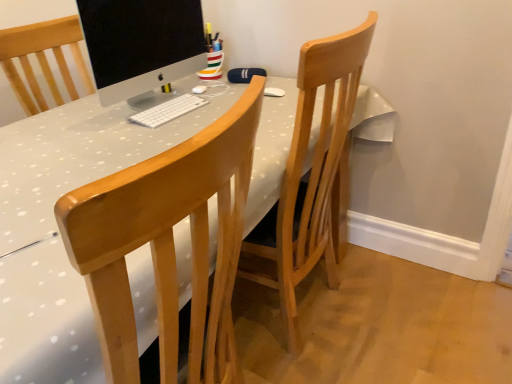
Question: Is sleek silver monitor at center taller or shorter than wooden chair at center?

Choices:
 (A) tall
 (B) short

Answer: (B)

Question: Do you think sleek silver monitor at center is within wooden chair at center, or outside of it?

Choices:
 (A) outside
 (B) inside

Answer: (A)

Question: Considering the real-world distances, which object is farthest from the white matte keyboard at center?

Choices:
 (A) wooden chair at center
 (B) sleek silver monitor at center

Answer: (A)

Question: Estimate the real-world distances between objects in this image. Which object is farther from the wooden chair at center?

Choices:
 (A) white matte keyboard at center
 (B) sleek silver monitor at center

Answer: (B)